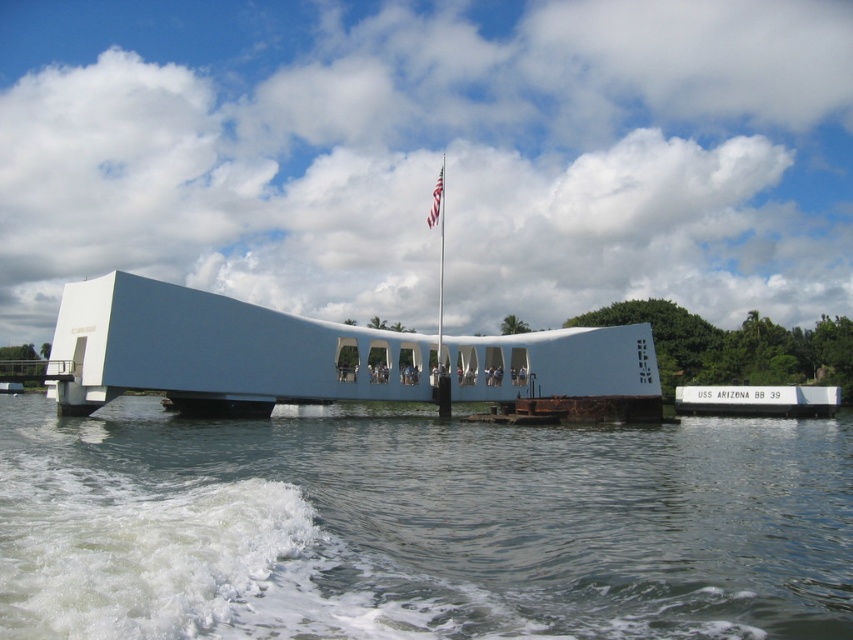
Does clear water at lower center have a greater width compared to white smooth memorial at center?

Yes, clear water at lower center is wider than white smooth memorial at center.

Is clear water at lower center smaller than white smooth memorial at center?

Incorrect, clear water at lower center is not smaller in size than white smooth memorial at center.

Find the location of a particular element. clear water at lower center is located at coordinates (419, 525).

Who is positioned more to the right, clear water at lower center or white concrete dock at center?

white concrete dock at center is more to the right.

Which of these two, clear water at lower center or white concrete dock at center, stands shorter?

Standing shorter between the two is white concrete dock at center.

What do you see at coordinates (419, 525) in the screenshot? The image size is (853, 640). I see `clear water at lower center` at bounding box center [419, 525].

Identify the location of clear water at lower center. (419, 525).

From the picture: Does white smooth memorial at center appear on the left side of white fabric flag at center?

In fact, white smooth memorial at center is to the right of white fabric flag at center.

Locate an element on the screen. The image size is (853, 640). white smooth memorial at center is located at coordinates (315, 356).

Is point (577, 376) closer to camera compared to point (436, 196)?

Yes, point (577, 376) is in front of point (436, 196).

This screenshot has width=853, height=640. What are the coordinates of `white smooth memorial at center` in the screenshot? It's located at (315, 356).